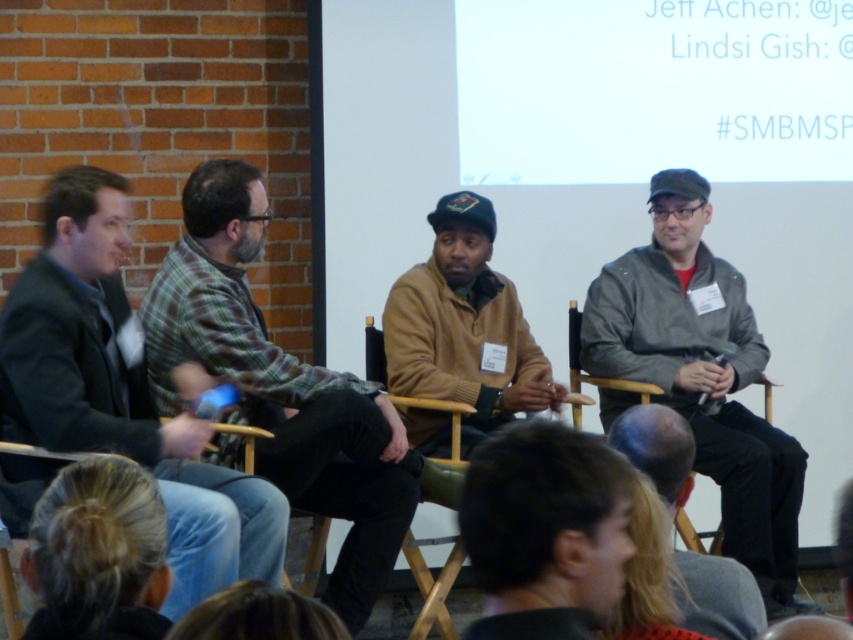
Question: Which point is closer to the camera?

Choices:
 (A) dark gray jacket at left
 (B) plaid fabric shirt at center
 (C) matte brown sweater at center

Answer: (A)

Question: Is dark brown hair at center below blonde hair at lower left?

Choices:
 (A) yes
 (B) no

Answer: (B)

Question: Is gray matte jacket at right positioned before dark brown hair at center?

Choices:
 (A) yes
 (B) no

Answer: (B)

Question: Which point is closer to the camera?

Choices:
 (A) plaid fabric shirt at center
 (B) dark gray jacket at left
 (C) dark brown hair at center

Answer: (C)

Question: Does plaid fabric shirt at center have a larger size compared to blonde hair at lower left?

Choices:
 (A) yes
 (B) no

Answer: (A)

Question: Among these objects, which one is farthest from the camera?

Choices:
 (A) dark gray jacket at left
 (B) blonde hair at lower left

Answer: (A)